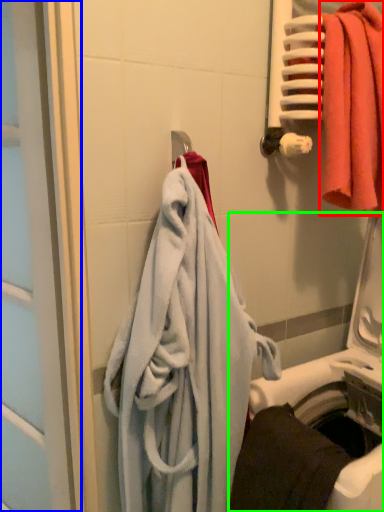
Question: Based on their relative distances, which object is nearer to towel (highlighted by a red box)? Choose from screen door (highlighted by a blue box) and washing machine (highlighted by a green box).

Choices:
 (A) screen door
 (B) washing machine

Answer: (B)